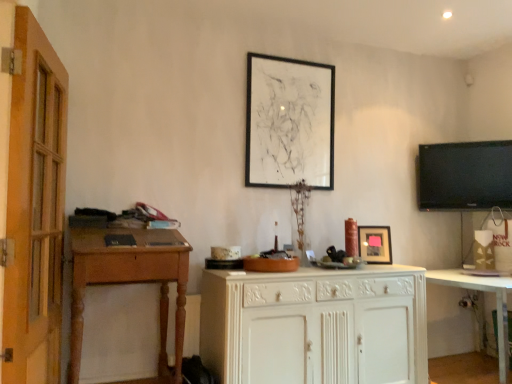
Question: Is white glossy cabinet at lower right at the left side of white painted wood cabinet at center?

Choices:
 (A) yes
 (B) no

Answer: (B)

Question: Would you say white painted wood cabinet at center is part of white glossy cabinet at lower right's contents?

Choices:
 (A) yes
 (B) no

Answer: (B)

Question: Considering the relative sizes of white glossy cabinet at lower right and white painted wood cabinet at center in the image provided, is white glossy cabinet at lower right thinner than white painted wood cabinet at center?

Choices:
 (A) no
 (B) yes

Answer: (A)

Question: Considering the relative sizes of white glossy cabinet at lower right and white painted wood cabinet at center in the image provided, is white glossy cabinet at lower right taller than white painted wood cabinet at center?

Choices:
 (A) yes
 (B) no

Answer: (B)

Question: Is white glossy cabinet at lower right smaller than white painted wood cabinet at center?

Choices:
 (A) no
 (B) yes

Answer: (B)

Question: Based on their sizes in the image, would you say black matte picture frame at upper center, which is the 2th picture frame from bottom to top, is bigger or smaller than white glossy cabinet at lower right?

Choices:
 (A) big
 (B) small

Answer: (B)

Question: From a real-world perspective, is black matte picture frame at upper center, placed as the first picture frame when sorted from top to bottom, above or below white glossy cabinet at lower right?

Choices:
 (A) above
 (B) below

Answer: (A)

Question: In terms of height, does black matte picture frame at upper center, the first picture frame when ordered from left to right, look taller or shorter compared to white glossy cabinet at lower right?

Choices:
 (A) short
 (B) tall

Answer: (B)

Question: Considering the positions of point (281, 182) and point (458, 273), is point (281, 182) closer or farther from the camera than point (458, 273)?

Choices:
 (A) closer
 (B) farther

Answer: (A)

Question: Considering the positions of point (311, 79) and point (466, 203), is point (311, 79) closer or farther from the camera than point (466, 203)?

Choices:
 (A) closer
 (B) farther

Answer: (A)

Question: From the image's perspective, is black matte picture frame at upper center, the 2th picture frame in the right-to-left sequence, located above or below black glossy tv at upper right?

Choices:
 (A) above
 (B) below

Answer: (A)

Question: Looking at the image, does black matte picture frame at upper center, which is the 2th picture frame from bottom to top, seem bigger or smaller compared to black glossy tv at upper right?

Choices:
 (A) big
 (B) small

Answer: (A)

Question: Is black matte picture frame at upper center, placed as the first picture frame when sorted from top to bottom, in front of or behind black glossy tv at upper right in the image?

Choices:
 (A) behind
 (B) front

Answer: (B)

Question: Is black glossy tv at upper right wider or thinner than white glossy cabinet at lower right?

Choices:
 (A) thin
 (B) wide

Answer: (A)

Question: From a real-world perspective, is black glossy tv at upper right physically located above or below white glossy cabinet at lower right?

Choices:
 (A) below
 (B) above

Answer: (B)